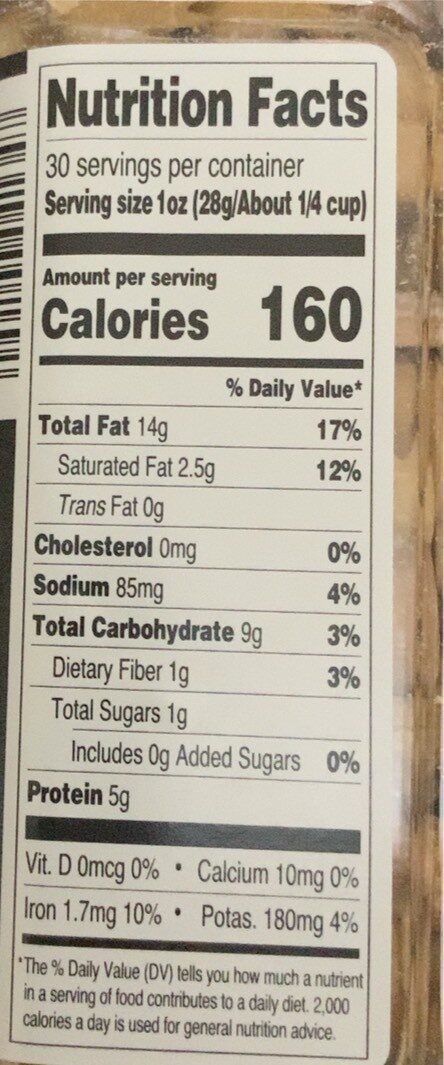
Image resolution: width=444 pixels, height=1065 pixels. What are the coordinates of `bottle` in the screenshot? It's located at (188, 30).